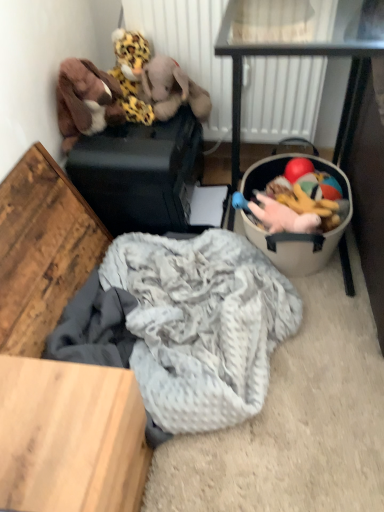
Question: Considering the positions of point (235, 182) and point (162, 378), is point (235, 182) closer or farther from the camera than point (162, 378)?

Choices:
 (A) farther
 (B) closer

Answer: (A)

Question: From a real-world perspective, is metallic black table at right positioned above or below soft gray knit blanket at lower center?

Choices:
 (A) above
 (B) below

Answer: (A)

Question: Estimate the real-world distances between objects in this image. Which object is farther from the white textured radiator at upper center?

Choices:
 (A) brown plush elephant at upper left
 (B) soft gray knit blanket at lower center
 (C) metallic black table at right
 (D) fluffy leopard print plush at upper left, the first toy when ordered from top to bottom
 (E) fluffy plush toys at right

Answer: (B)

Question: Estimate the real-world distances between objects in this image. Which object is farther from the white textured radiator at upper center?

Choices:
 (A) brown plush elephant at upper left
 (B) soft gray knit blanket at lower center
 (C) brown plush toy at upper left, marked as the 2th toy in a top-to-bottom arrangement
 (D) metallic black table at right
 (E) fluffy plush toys at right

Answer: (B)